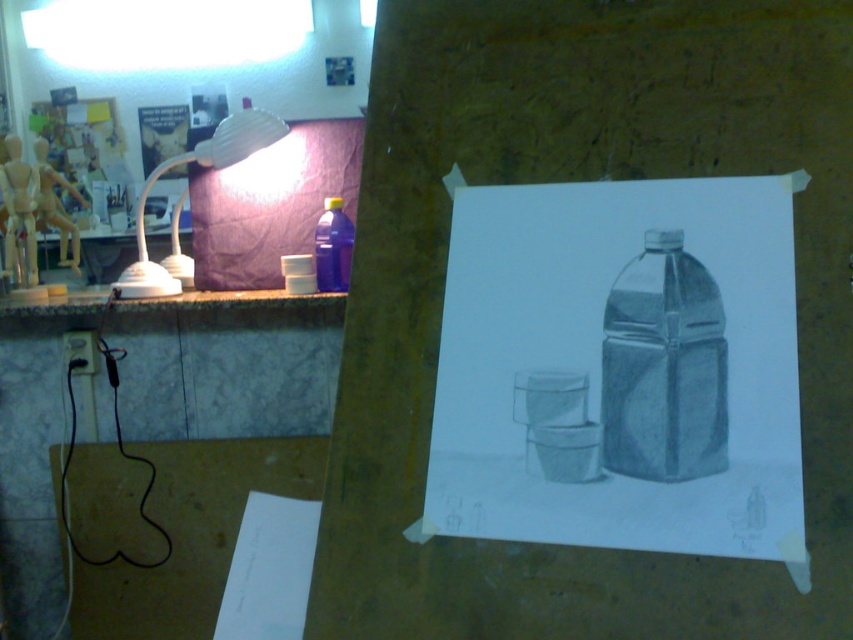
You are an artist who needs to know the size relationship between the gray paper at center and the translucent blue plastic bottle at upper center in the workspace setup. Which one has a greater width?

The gray paper at center has a greater width than the translucent blue plastic bottle at upper center according to the description.

You are standing in front of the workspace and want to place a 12 inch ruler on the desk. If you want to place it directly in front of you, will it fit between you and the gray paper at center?

The distance between you and the gray paper at center is 27.14 inches, so placing a 12 inch ruler directly in front of you would leave enough space. The ruler can be placed there since 12 inches is less than the 27.14 inches available.